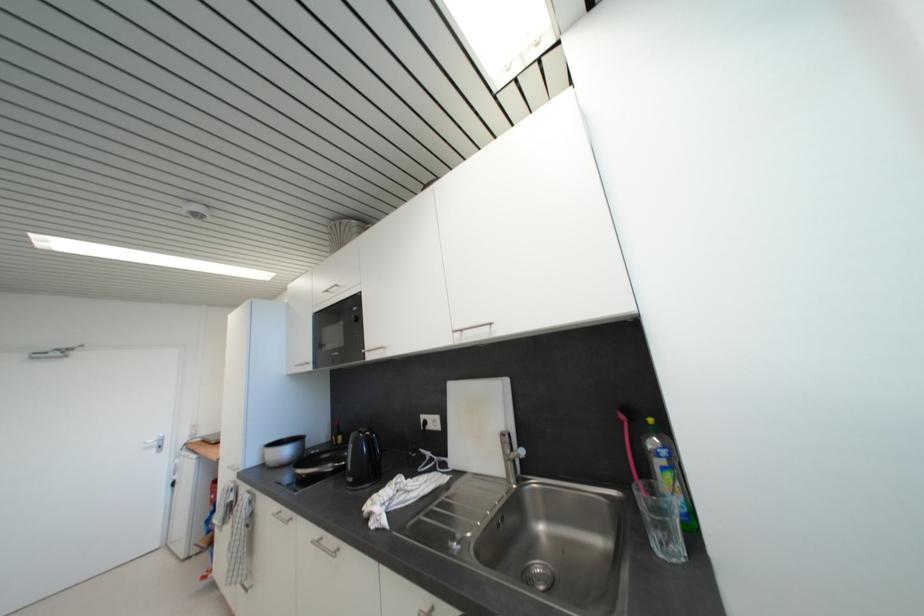
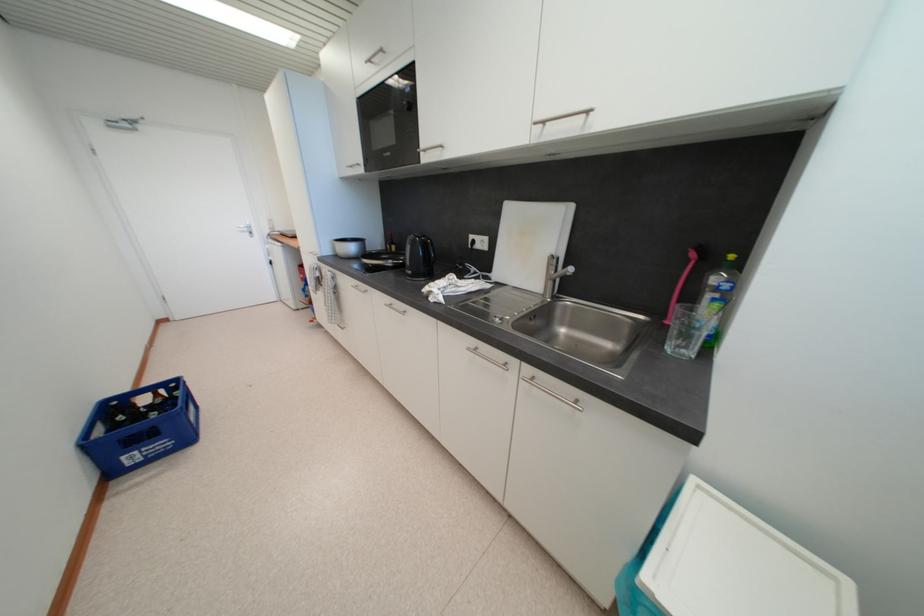
Find the pixel in the second image that matches point (318, 544) in the first image.

(391, 307)